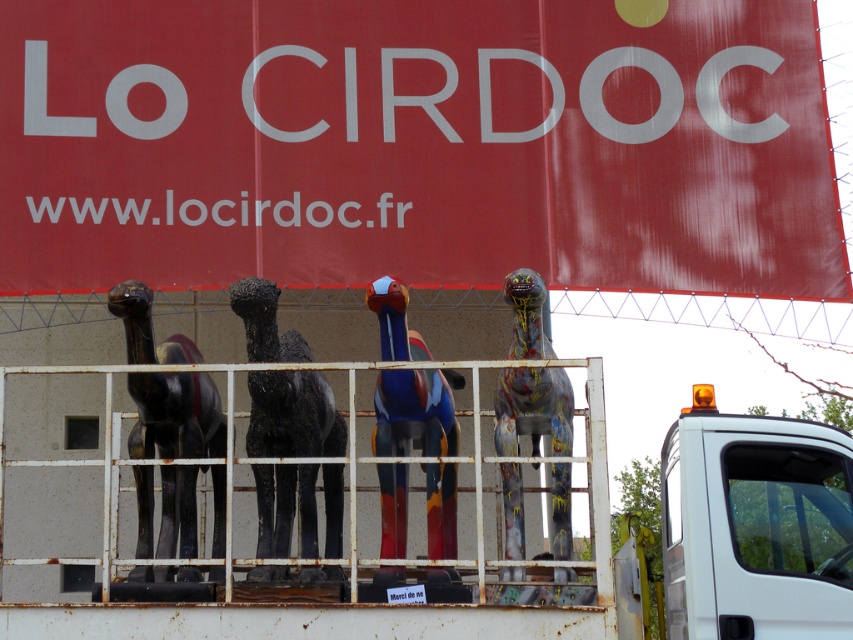
Question: From the image, what is the correct spatial relationship of painted wood bird at center in relation to painted wood dinosaur at center?

Choices:
 (A) left
 (B) right

Answer: (A)

Question: Considering the relative positions of shiny black camel at left and painted wood dinosaur at center in the image provided, where is shiny black camel at left located with respect to painted wood dinosaur at center?

Choices:
 (A) left
 (B) right

Answer: (A)

Question: Which object is positioned farthest from the red matte sign at upper center?

Choices:
 (A) rusty metal rail at center
 (B) painted wood bird at center

Answer: (A)

Question: Does white plastic truck at lower right lie behind painted wood dinosaur at center?

Choices:
 (A) no
 (B) yes

Answer: (A)

Question: Which is farther from the red matte sign at upper center?

Choices:
 (A) shiny black camel at left
 (B) painted wood bird at center
 (C) rusty metal rail at center
 (D) painted wood dinosaur at center

Answer: (C)

Question: Which point is farther from the camera taking this photo?

Choices:
 (A) (380, 545)
 (B) (260, 324)
 (C) (756, 76)

Answer: (C)